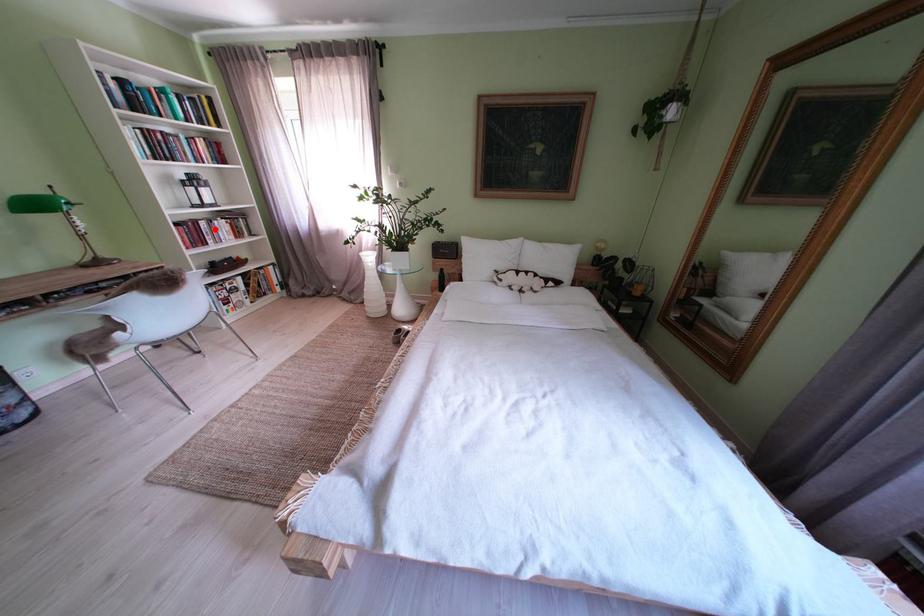
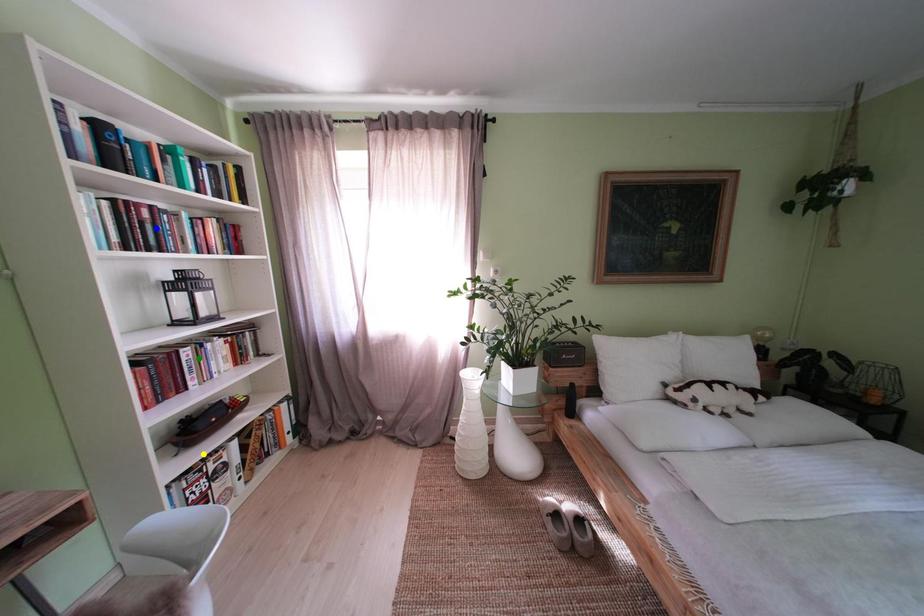
Question: I am providing you with two images of the same scene from different viewpoints. A red point is marked on the first image. You are given multiple points on the second image. Which point in image 2 is actually the same real-world point as the red point in image 1?

Choices:
 (A) blue point
 (B) green point
 (C) yellow point

Answer: (B)